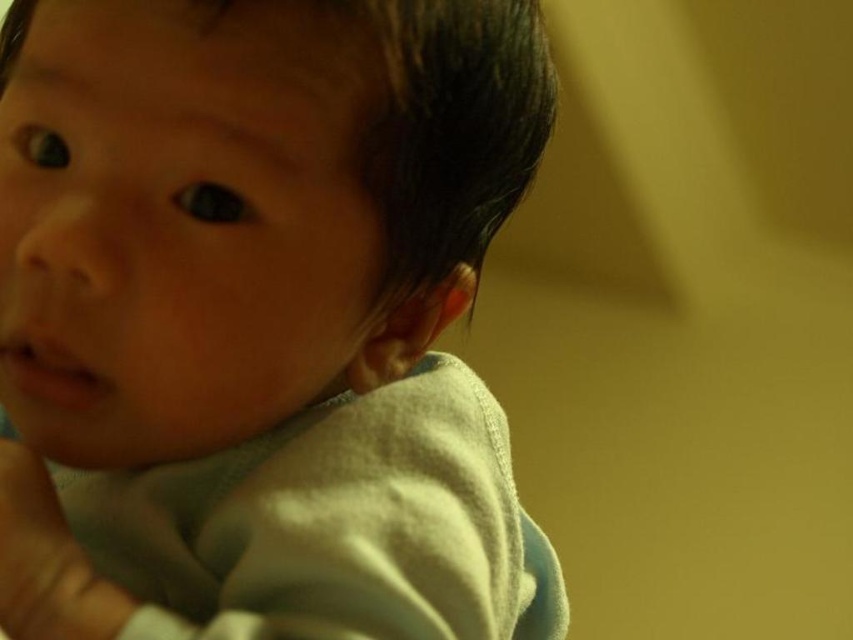
Question: Among these objects, which one is farthest from the camera?

Choices:
 (A) smooth skin baby at center
 (B) white soft hand at lower left

Answer: (B)

Question: Among these objects, which one is farthest from the camera?

Choices:
 (A) white soft hand at lower left
 (B) smooth skin baby at center

Answer: (A)

Question: Can you confirm if smooth skin baby at center is smaller than white soft hand at lower left?

Choices:
 (A) no
 (B) yes

Answer: (A)

Question: Where is smooth skin baby at center located in relation to white soft hand at lower left in the image?

Choices:
 (A) below
 (B) above

Answer: (B)

Question: Can you confirm if smooth skin baby at center is positioned to the right of white soft hand at lower left?

Choices:
 (A) yes
 (B) no

Answer: (A)